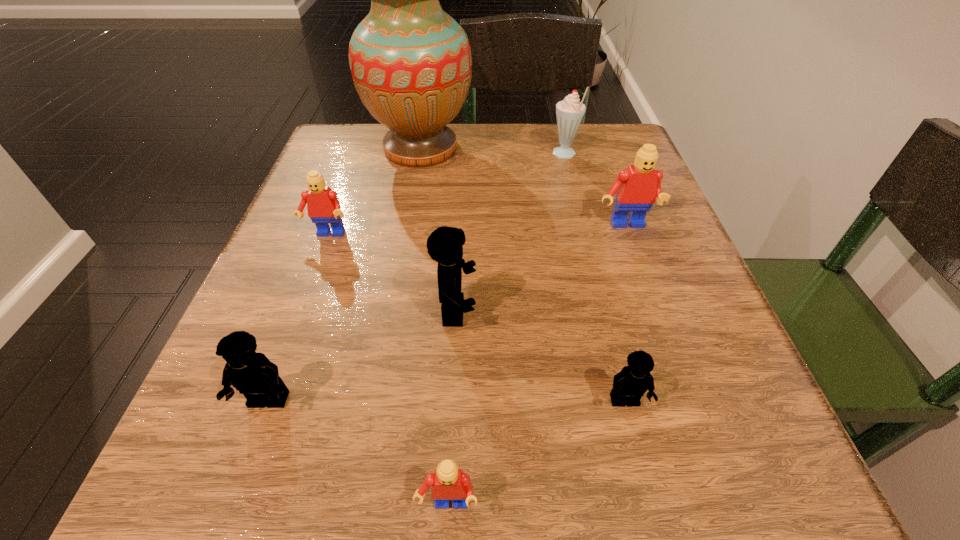
What are the coordinates of `milkshake situated at the far edge` in the screenshot? It's located at click(x=569, y=112).

At what (x,y) coordinates should I click in order to perform the action: click on object that is positioned at the near edge. Please return your answer as a coordinate pair (x, y). Looking at the image, I should click on (448, 482).

Find the location of `vase at the left edge`. vase at the left edge is located at coordinates (411, 64).

Find the location of a particular element. milkshake positioned at the right edge is located at coordinates (569, 112).

I want to click on object present at the far left corner, so click(411, 64).

This screenshot has height=540, width=960. What are the coordinates of `object at the far right corner` in the screenshot? It's located at (569, 112).

This screenshot has width=960, height=540. What are the coordinates of `free location at the far edge of the desktop` in the screenshot? It's located at (408, 167).

Locate an element on the screen. Image resolution: width=960 pixels, height=540 pixels. free space at the near edge of the desktop is located at coordinates (473, 449).

Where is `vacant space at the left edge of the desktop`? vacant space at the left edge of the desktop is located at coordinates (348, 207).

Image resolution: width=960 pixels, height=540 pixels. In order to click on vacant space at the right edge of the desktop in this screenshot , I will do click(x=671, y=229).